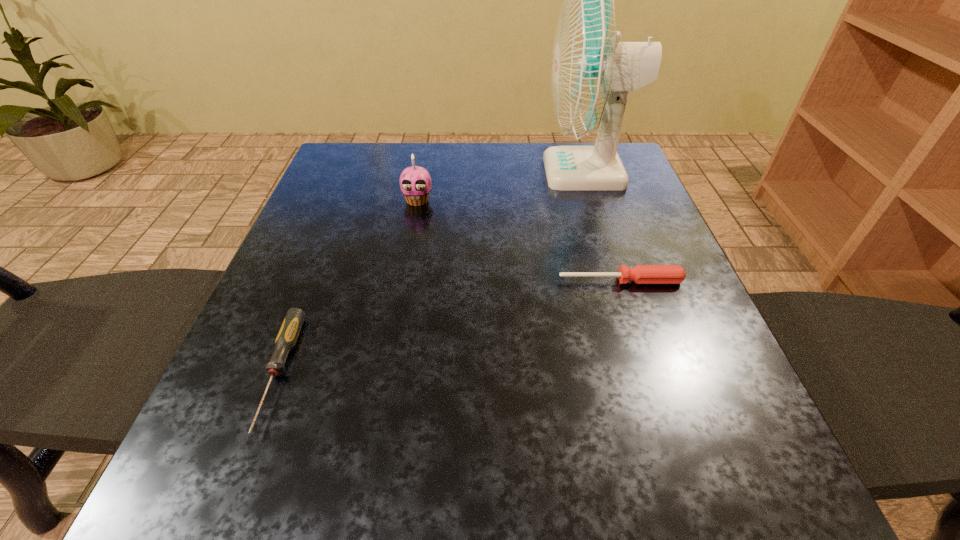
At what (x,y) coordinates should I click in order to perform the action: click on vacant area that lies between the left screwdriver and the fan. Please return your answer as a coordinate pair (x, y). Looking at the image, I should click on (432, 272).

Image resolution: width=960 pixels, height=540 pixels. What are the coordinates of `vacant space in between the second object from left to right and the nearest object` in the screenshot? It's located at 348,286.

Locate an element on the screen. The width and height of the screenshot is (960, 540). vacant region between the nearest object and the tallest object is located at coordinates (432, 272).

Locate which object ranks second in proximity to the fan. Please provide its 2D coordinates. Your answer should be formatted as a tuple, i.e. [(x, y)], where the tuple contains the x and y coordinates of a point satisfying the conditions above.

[(415, 182)]

The image size is (960, 540). Identify the location of object that stands as the third closest to the cupcake. (286, 339).

The width and height of the screenshot is (960, 540). In order to click on vacant space that satisfies the following two spatial constraints: 1. on the face of the second tallest object; 2. on the left side of the farther screwdriver in this screenshot , I will do `click(403, 281)`.

This screenshot has width=960, height=540. Identify the location of free space that satisfies the following two spatial constraints: 1. in front of the tallest object to face the airflow; 2. insert the leftmost object into a screw head. (652, 373).

At what (x,y) coordinates should I click in order to perform the action: click on vacant position in the image that satisfies the following two spatial constraints: 1. on the face of the second nearest object; 2. on the left side of the second object from left to right. Please return your answer as a coordinate pair (x, y). Looking at the image, I should click on (403, 281).

I want to click on vacant space that satisfies the following two spatial constraints: 1. in front of the tallest object to face the airflow; 2. on the face of the second tallest object, so click(595, 200).